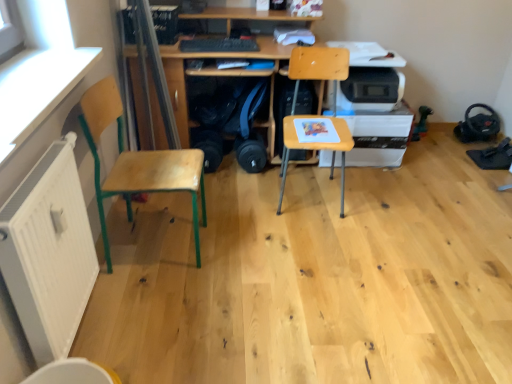
Question: Is white plastic printer at center right looking in the opposite direction of white matte radiator at lower left?

Choices:
 (A) no
 (B) yes

Answer: (A)

Question: Would you say white plastic printer at center right is a long distance from white matte radiator at lower left?

Choices:
 (A) no
 (B) yes

Answer: (B)

Question: Can you confirm if white plastic printer at center right is bigger than white matte radiator at lower left?

Choices:
 (A) no
 (B) yes

Answer: (B)

Question: From a real-world perspective, is white plastic printer at center right physically below white matte radiator at lower left?

Choices:
 (A) yes
 (B) no

Answer: (A)

Question: From the image's perspective, does white plastic printer at center right appear lower than white matte radiator at lower left?

Choices:
 (A) yes
 (B) no

Answer: (B)

Question: In terms of height, does white plastic printer at center right look taller or shorter compared to wooden chair at center, the second chair when ordered from left to right?

Choices:
 (A) tall
 (B) short

Answer: (B)

Question: Would you say white plastic printer at center right is to the left or to the right of wooden chair at center, arranged as the first chair when viewed from the right, in the picture?

Choices:
 (A) right
 (B) left

Answer: (A)

Question: Is white plastic printer at center right inside or outside of wooden chair at center, arranged as the first chair when viewed from the right?

Choices:
 (A) outside
 (B) inside

Answer: (A)

Question: In the image, is white plastic printer at center right positioned in front of or behind wooden chair at center, the second chair when ordered from left to right?

Choices:
 (A) behind
 (B) front

Answer: (A)

Question: Considering the positions of point (206, 46) and point (40, 210), is point (206, 46) closer or farther from the camera than point (40, 210)?

Choices:
 (A) farther
 (B) closer

Answer: (A)

Question: From their relative heights in the image, would you say black matte keyboard at center is taller or shorter than white matte radiator at lower left?

Choices:
 (A) tall
 (B) short

Answer: (B)

Question: In terms of size, does black matte keyboard at center appear bigger or smaller than white matte radiator at lower left?

Choices:
 (A) small
 (B) big

Answer: (A)

Question: Which is correct: black matte keyboard at center is inside white matte radiator at lower left, or outside of it?

Choices:
 (A) outside
 (B) inside

Answer: (A)

Question: Would you say wooden chair at center, arranged as the first chair when viewed from the right, is inside or outside wooden desk at center?

Choices:
 (A) inside
 (B) outside

Answer: (B)

Question: From a real-world perspective, relative to wooden desk at center, is wooden chair at center, arranged as the first chair when viewed from the right, vertically above or below?

Choices:
 (A) below
 (B) above

Answer: (A)